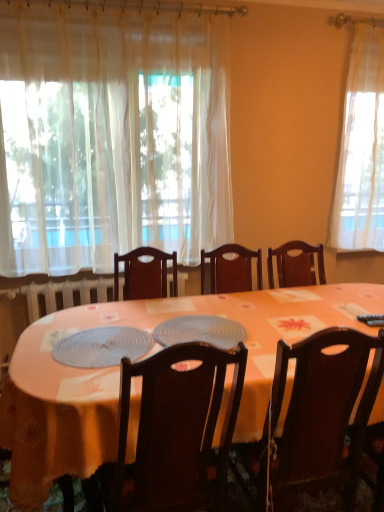
You are a GUI agent. You are given a task and a screenshot of the screen. Output one action in this format:
    pyautogui.click(x=<x>, y=<y>)
    Task: Click on the free spot in front of translucent plastic platter at center, positioned as the 1th platter in left-to-right order
    This screenshot has height=512, width=384.
    Given the screenshot: What is the action you would take?
    pyautogui.click(x=76, y=382)